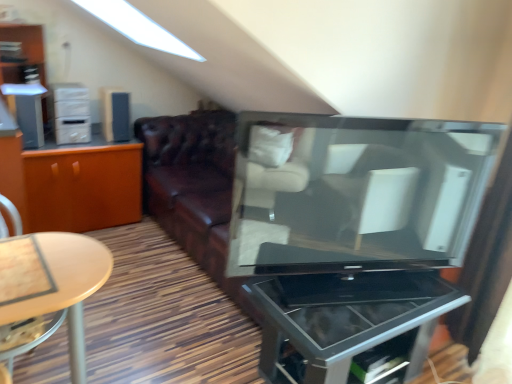
Question: Can you confirm if satin black speaker at upper left, arranged as the 2th appliance when viewed from the left, is bigger than satin silver speaker at left, which is counted as the 1th appliance, starting from the left?

Choices:
 (A) yes
 (B) no

Answer: (A)

Question: From the image's perspective, would you say satin black speaker at upper left, positioned as the 2th appliance in front-to-back order, is positioned over satin silver speaker at left, which is counted as the 1th appliance, starting from the left?

Choices:
 (A) yes
 (B) no

Answer: (A)

Question: Does satin black speaker at upper left, positioned as the 2th appliance in front-to-back order, turn towards satin silver speaker at left, which is counted as the 1th appliance, starting from the left?

Choices:
 (A) no
 (B) yes

Answer: (A)

Question: Is satin black speaker at upper left, arranged as the 2th appliance when viewed from the left, at the right side of satin silver speaker at left, which is the 1th appliance in front-to-back order?

Choices:
 (A) no
 (B) yes

Answer: (B)

Question: Can you confirm if satin black speaker at upper left, the first appliance from the right, is thinner than satin silver speaker at left, arranged as the second appliance when viewed from the right?

Choices:
 (A) no
 (B) yes

Answer: (A)

Question: Would you say satin silver speaker at left, which is the 1th appliance in front-to-back order, is part of satin black speaker at upper left, the first appliance from the back,'s contents?

Choices:
 (A) yes
 (B) no

Answer: (B)

Question: Is satin black speaker at upper left, arranged as the 2th appliance when viewed from the left, not inside matte black television at center?

Choices:
 (A) no
 (B) yes

Answer: (B)

Question: Is satin black speaker at upper left, positioned as the 2th appliance in front-to-back order, to the right of matte black television at center from the viewer's perspective?

Choices:
 (A) yes
 (B) no

Answer: (B)

Question: Does satin black speaker at upper left, positioned as the 2th appliance in front-to-back order, have a larger size compared to matte black television at center?

Choices:
 (A) no
 (B) yes

Answer: (A)

Question: Is satin black speaker at upper left, the first appliance from the right, thinner than matte black television at center?

Choices:
 (A) yes
 (B) no

Answer: (B)

Question: Is satin black speaker at upper left, positioned as the 2th appliance in front-to-back order, oriented towards matte black television at center?

Choices:
 (A) no
 (B) yes

Answer: (B)

Question: From a real-world perspective, does satin black speaker at upper left, positioned as the 2th appliance in front-to-back order, sit lower than matte black television at center?

Choices:
 (A) yes
 (B) no

Answer: (A)

Question: Considering the relative positions of metallic glass tv stand at center and matte black television at center in the image provided, is metallic glass tv stand at center to the right of matte black television at center from the viewer's perspective?

Choices:
 (A) yes
 (B) no

Answer: (B)